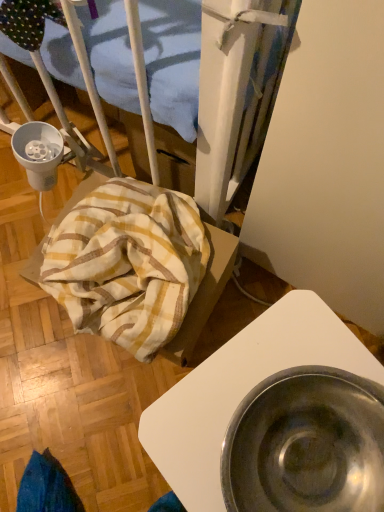
The height and width of the screenshot is (512, 384). Identify the location of free region on the left part of yellow-white striped fabric at lower left. (34, 303).